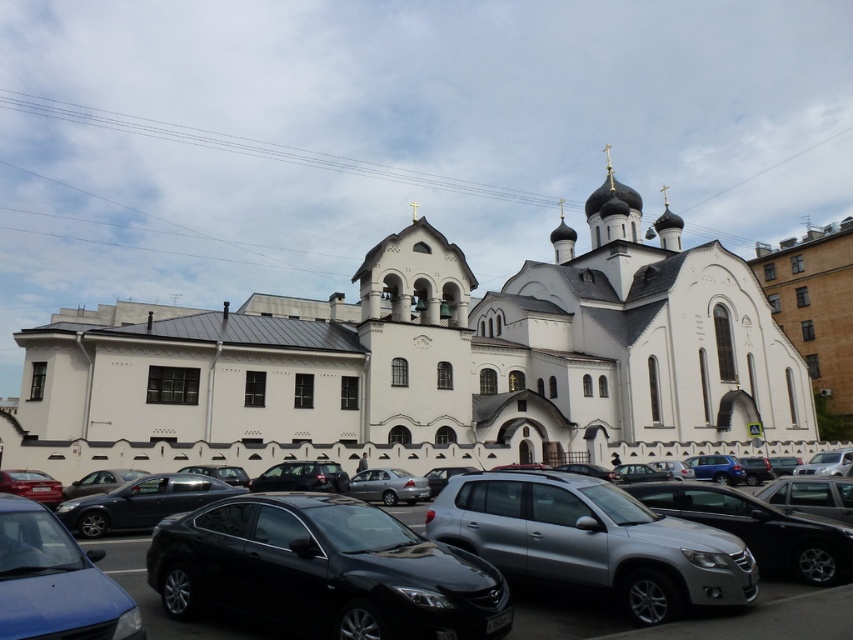
From the picture: You are standing at the entrance of the white church and want to park your car in the parking lot. The entrance is located at the center of the church. Which direction should you walk to reach the matte black sedan at lower left?

Since the matte black sedan at lower left is located at point (55, 580), you should walk towards the lower left direction from the entrance to reach it.

Looking at this image, you are a delivery person trying to park your 1.8 meters wide van. You see the matte black sedan at lower left and the shiny red sedan at lower left in the parking lot. Which vehicle takes up more space in width?

The matte black sedan at lower left has a greater width than the shiny red sedan at lower left, so it takes up more space in width.

You are standing in front of the church and want to take a photo that includes both the point at coordinates point [108,506] and point [51,481]. Which point should you position closer to the camera in your photo?

You should position the point at coordinates point [108,506] closer to the camera in your photo because it is already closer to the camera than point [51,481] according to the description.